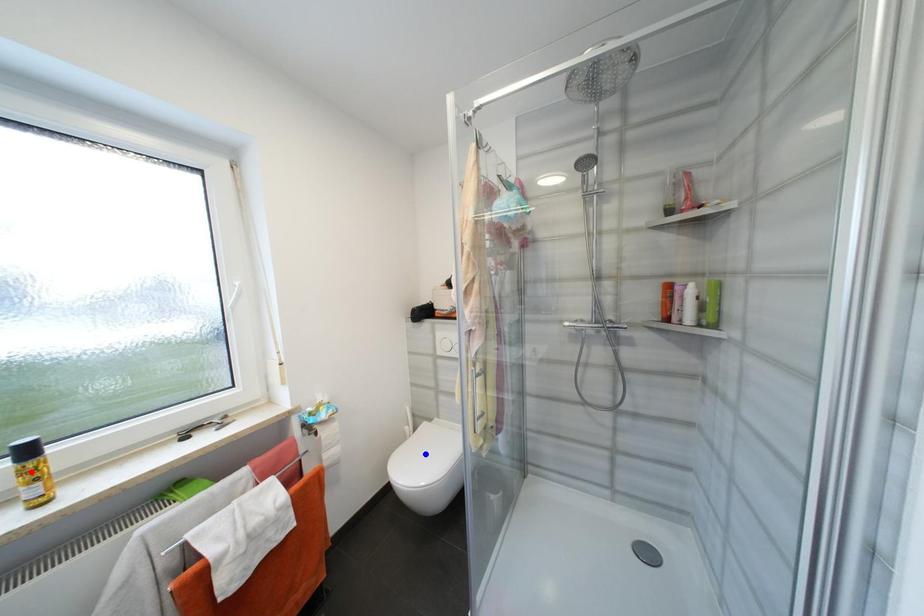
Question: Which of the two points in the image is closer to the camera?

Choices:
 (A) Blue point is closer.
 (B) Red point is closer.

Answer: (B)